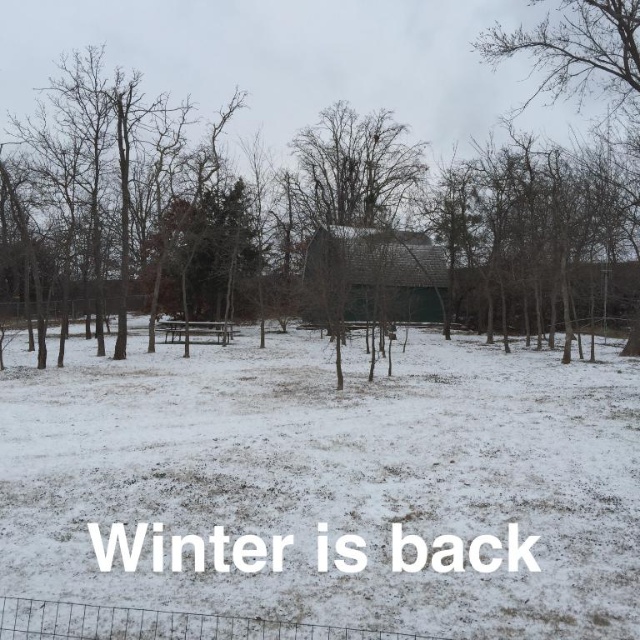
Question: Which point is farther from the camera taking this photo?

Choices:
 (A) (320, 304)
 (B) (632, 332)

Answer: (B)

Question: Can you confirm if dark gray shingles barn at center is bigger than bare branches at upper right?

Choices:
 (A) yes
 (B) no

Answer: (B)

Question: Which of the following is the farthest from the observer?

Choices:
 (A) dark gray shingles barn at center
 (B) bare branches at upper right

Answer: (B)

Question: Does dark gray shingles barn at center have a larger size compared to bare branches at upper right?

Choices:
 (A) yes
 (B) no

Answer: (B)

Question: Is dark gray shingles barn at center thinner than bare branches at upper right?

Choices:
 (A) no
 (B) yes

Answer: (A)